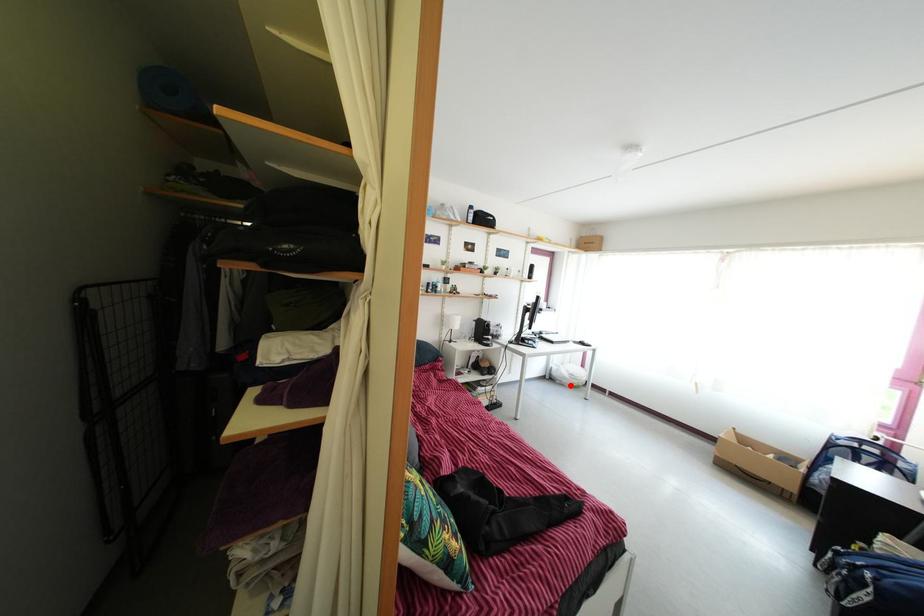
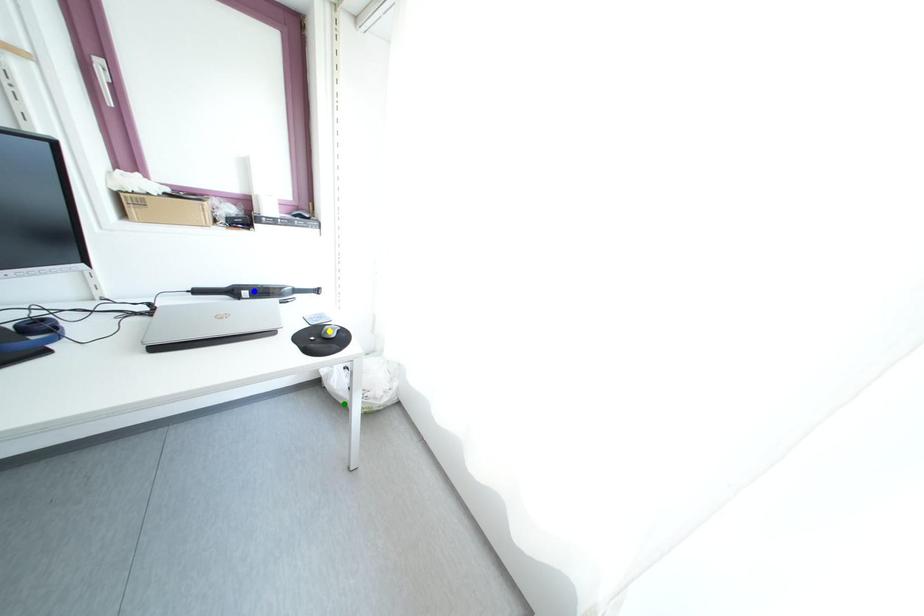
Question: I am providing you with two images of the same scene from different viewpoints. A red point is marked on the first image. You are given multiple points on the second image. Which spot in image 2 lines up with the point in image 1?

Choices:
 (A) green point
 (B) blue point
 (C) yellow point

Answer: (A)